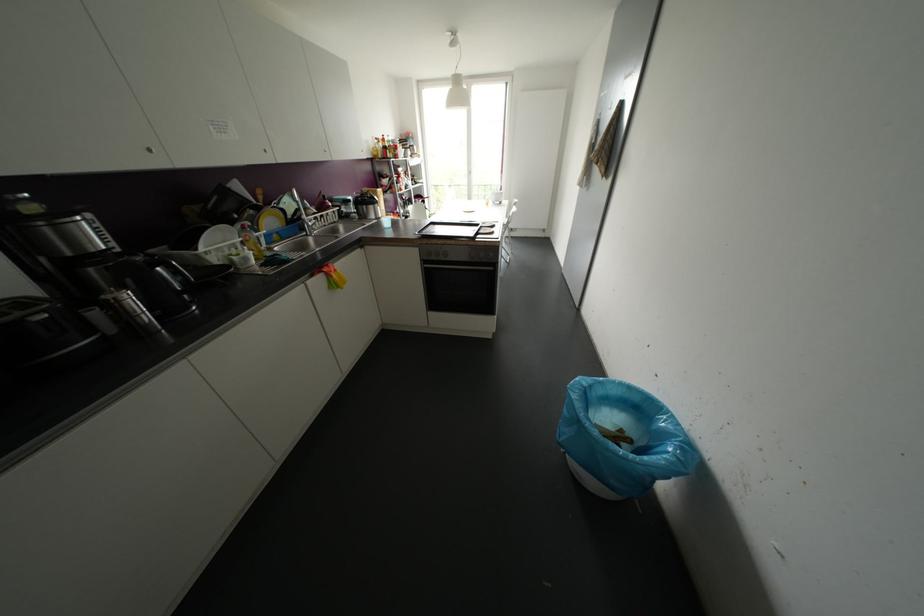
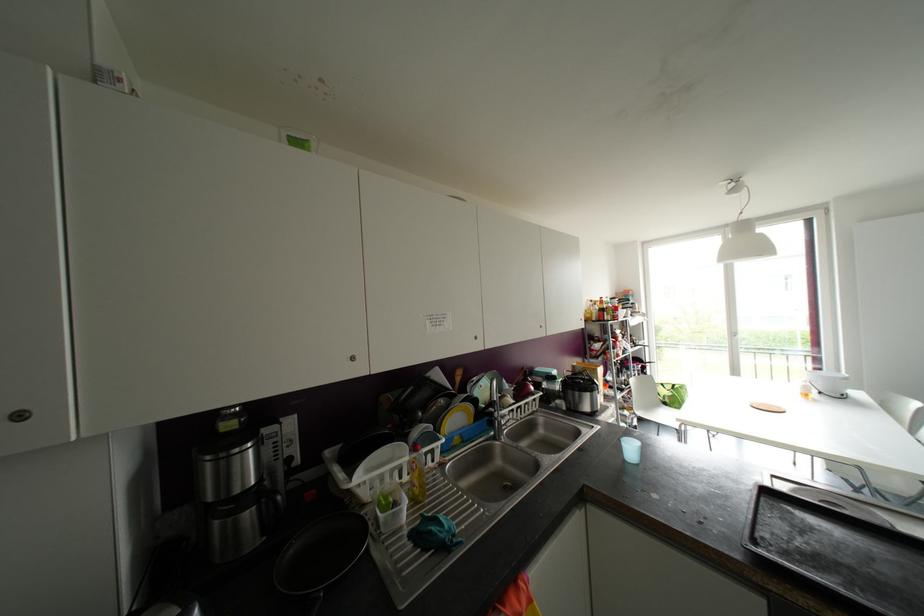
In the second image, find the point that corresponds to point (385, 220) in the first image.

(629, 448)